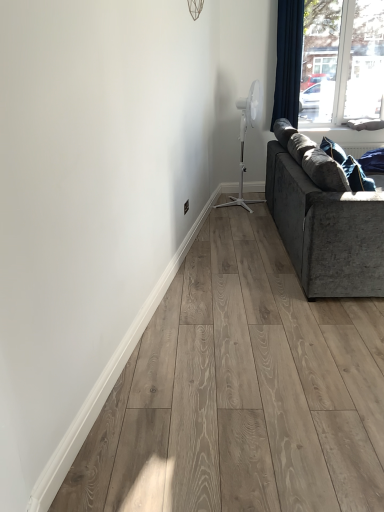
This screenshot has width=384, height=512. In order to click on free spot below white plastic fan at upper right (from a real-world perspective) in this screenshot , I will do `click(231, 199)`.